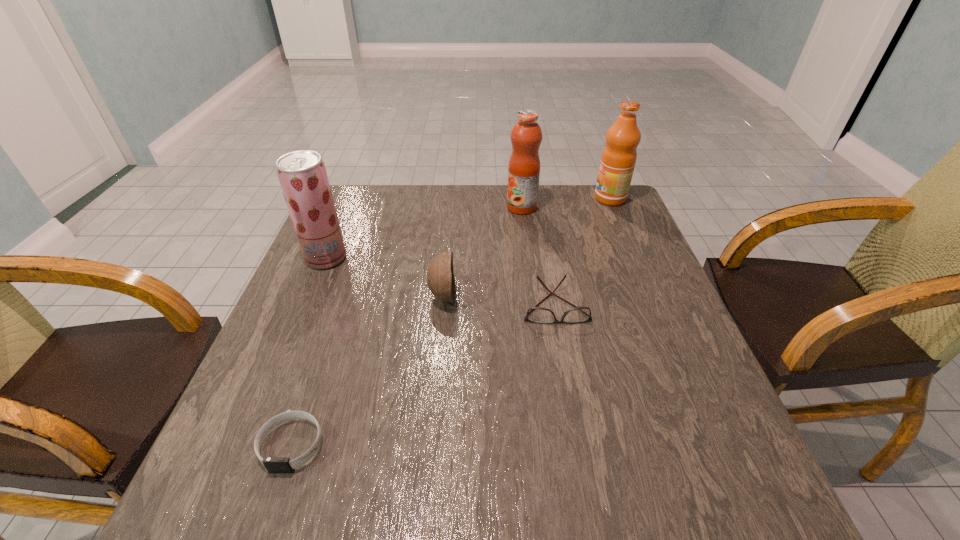
Identify the location of object that can be found as the fifth closest to the nearest fruit juice. (618, 159).

I want to click on the third closest fruit juice to the spectacles, so click(302, 174).

Point out which fruit juice is positioned as the nearest to the nearest fruit juice. Please provide its 2D coordinates. Your answer should be formatted as a tuple, i.e. [(x, y)], where the tuple contains the x and y coordinates of a point satisfying the conditions above.

[(526, 136)]

Where is `vacant space that satisfies the following two spatial constraints: 1. on the label side of the rightmost object; 2. on the front side of the bowl`? vacant space that satisfies the following two spatial constraints: 1. on the label side of the rightmost object; 2. on the front side of the bowl is located at coordinates (652, 296).

This screenshot has height=540, width=960. What are the coordinates of `free point that satisfies the following two spatial constraints: 1. on the label side of the rightmost object; 2. on the front side of the third farthest object` in the screenshot? It's located at (636, 258).

Find the location of `free region that satisfies the following two spatial constraints: 1. on the label side of the rightmost object; 2. on the front side of the bowl`. free region that satisfies the following two spatial constraints: 1. on the label side of the rightmost object; 2. on the front side of the bowl is located at coordinates (652, 296).

Where is `free location that satisfies the following two spatial constraints: 1. on the label side of the rightmost object; 2. on the front side of the third farthest object`? The width and height of the screenshot is (960, 540). free location that satisfies the following two spatial constraints: 1. on the label side of the rightmost object; 2. on the front side of the third farthest object is located at coordinates (636, 258).